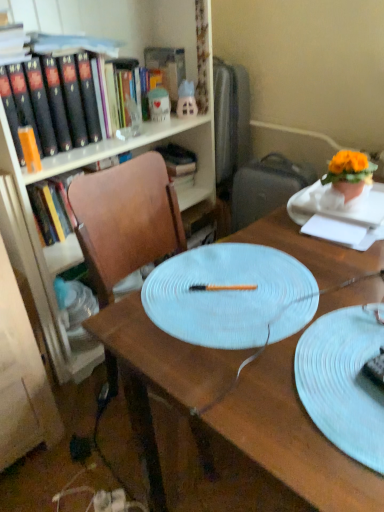
Question: Is white paper at upper right not close to orange matte book at left, positioned as the 1th book in front-to-back order?

Choices:
 (A) no
 (B) yes

Answer: (A)

Question: Does white paper at upper right have a larger size compared to orange matte book at left, the 2th book positioned from the right?

Choices:
 (A) yes
 (B) no

Answer: (B)

Question: Is white paper at upper right not within orange matte book at left, positioned as the 1th book in front-to-back order?

Choices:
 (A) no
 (B) yes

Answer: (B)

Question: From the image's perspective, is white paper at upper right below orange matte book at left, which appears as the first book when viewed from the left?

Choices:
 (A) no
 (B) yes

Answer: (B)

Question: Does white paper at upper right turn towards orange matte book at left, which appears as the first book when viewed from the left?

Choices:
 (A) yes
 (B) no

Answer: (B)

Question: Would you say chocolate cake at center is inside or outside gray fabric suitcase at right?

Choices:
 (A) outside
 (B) inside

Answer: (A)

Question: In terms of width, does chocolate cake at center look wider or thinner when compared to gray fabric suitcase at right?

Choices:
 (A) thin
 (B) wide

Answer: (A)

Question: Does point (382, 381) appear closer or farther from the camera than point (248, 198)?

Choices:
 (A) closer
 (B) farther

Answer: (A)

Question: Considering the positions of chocolate cake at center and gray fabric suitcase at right in the image, is chocolate cake at center bigger or smaller than gray fabric suitcase at right?

Choices:
 (A) big
 (B) small

Answer: (B)

Question: From a real-world perspective, is white paper at upper right physically located above or below wooden desk at center?

Choices:
 (A) above
 (B) below

Answer: (A)

Question: From the image's perspective, relative to wooden desk at center, is white paper at upper right above or below?

Choices:
 (A) above
 (B) below

Answer: (A)

Question: Based on their positions, is white paper at upper right located to the left or right of wooden desk at center?

Choices:
 (A) right
 (B) left

Answer: (A)

Question: Is white paper at upper right wider or thinner than wooden desk at center?

Choices:
 (A) wide
 (B) thin

Answer: (B)

Question: Is matte white ceramic mug at upper center, the first toy positioned from the left, inside the boundaries of chocolate cake at center, or outside?

Choices:
 (A) outside
 (B) inside

Answer: (A)

Question: Is matte white ceramic mug at upper center, the first toy positioned from the left, taller or shorter than chocolate cake at center?

Choices:
 (A) tall
 (B) short

Answer: (A)